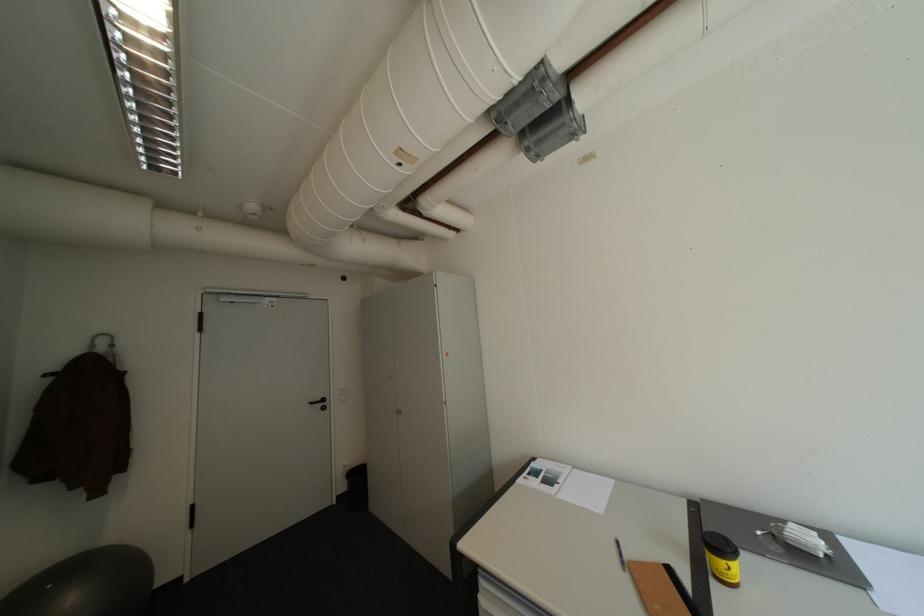
You are a GUI agent. You are given a task and a screenshot of the screen. Output one action in this format:
    pyautogui.click(x=<x>, y=<y>)
    Task: Click on the small cabinet handle
    This screenshot has width=924, height=616.
    Given the screenshot: What is the action you would take?
    pyautogui.click(x=396, y=413)